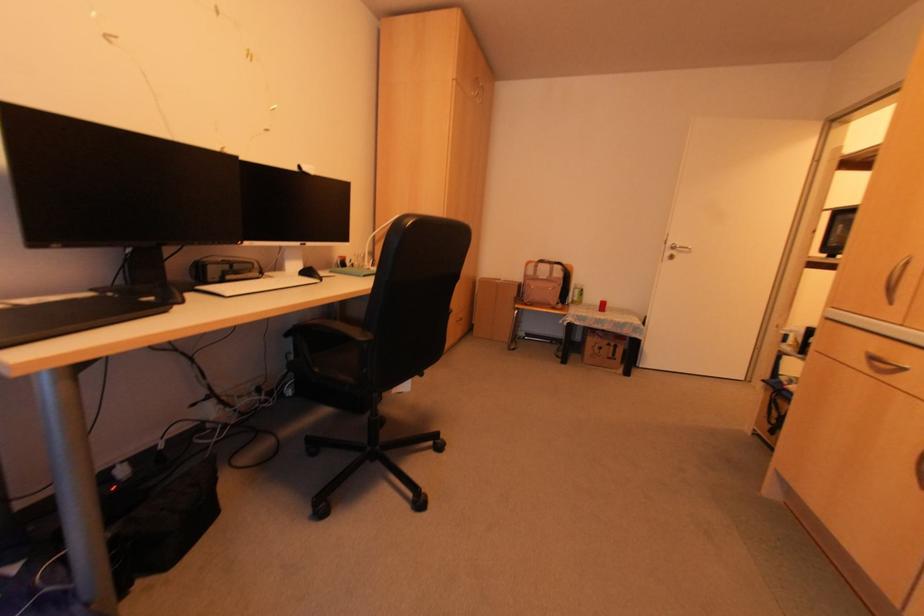
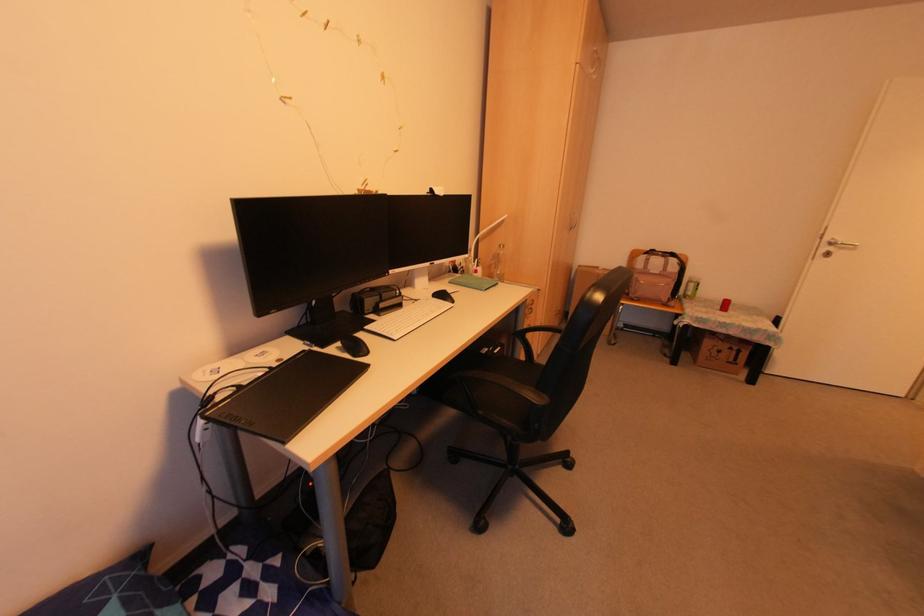
The point at (366, 262) is marked in the first image. Where is the corresponding point in the second image?

(472, 262)